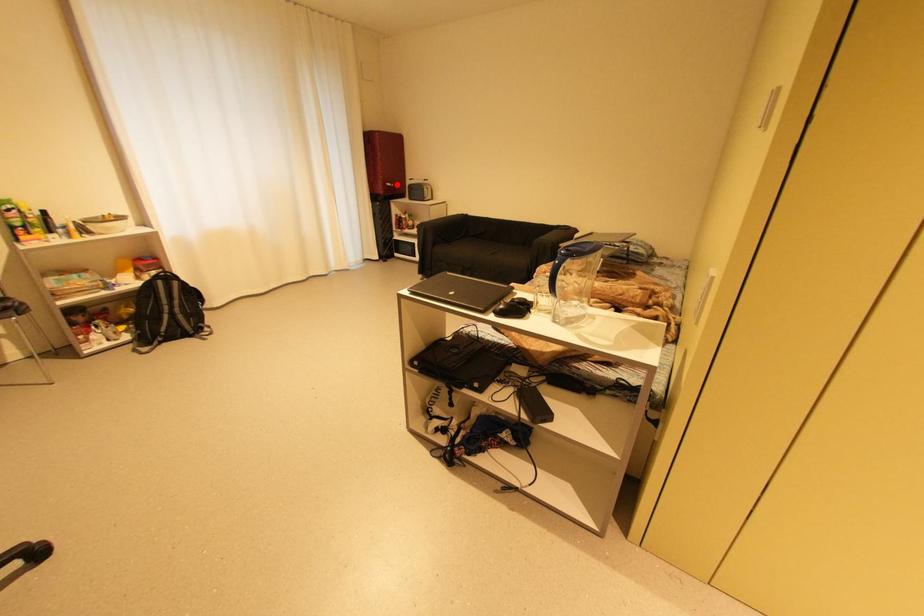
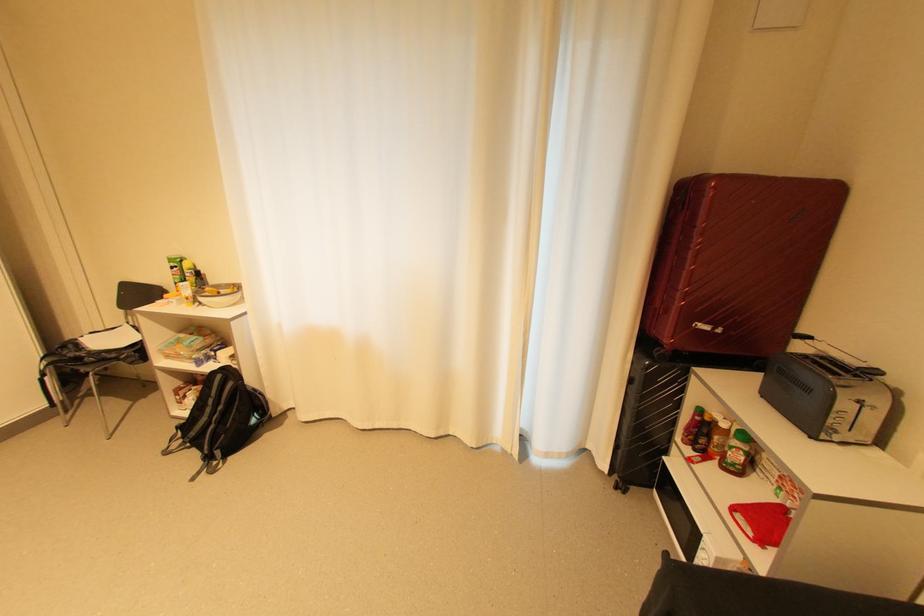
Question: I am providing you with two images of the same scene from different viewpoints. Given a red point in image1, look at the same physical point in image2. Is it:

Choices:
 (A) Closer to the viewpoint
 (B) Farther from the viewpoint

Answer: (B)